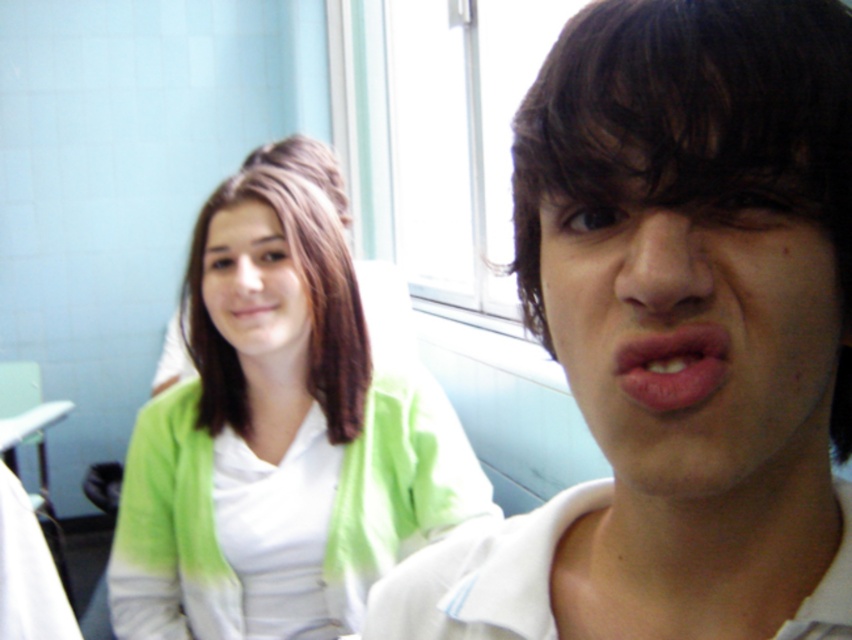
Question: Which point is closer to the camera taking this photo?

Choices:
 (A) (671, 83)
 (B) (271, 310)

Answer: (A)

Question: Among these objects, which one is nearest to the camera?

Choices:
 (A) matte skin face at center
 (B) matte white shirt at center
 (C) matte white mouth at center
 (D) green fabric cardigan at upper left

Answer: (B)

Question: Is matte skin face at center positioned at the back of matte white mouth at center?

Choices:
 (A) yes
 (B) no

Answer: (B)

Question: Can you confirm if matte white shirt at center is positioned to the left of matte white mouth at center?

Choices:
 (A) yes
 (B) no

Answer: (B)

Question: Among these points, which one is farthest from the camera?

Choices:
 (A) pos(720,355)
 (B) pos(367,513)

Answer: (B)

Question: Is matte white shirt at center thinner than matte green cardigan at upper left?

Choices:
 (A) yes
 (B) no

Answer: (B)